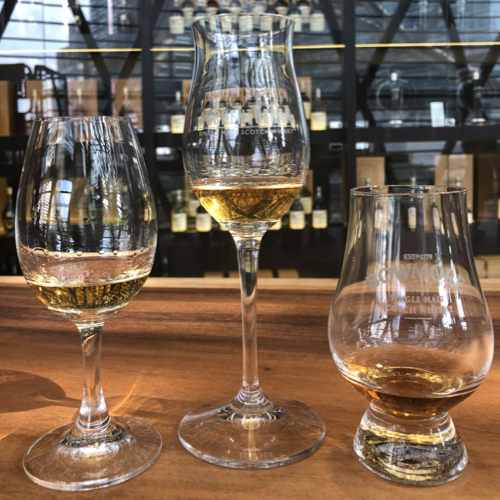
Where is `short glass`? short glass is located at coordinates (391, 339).